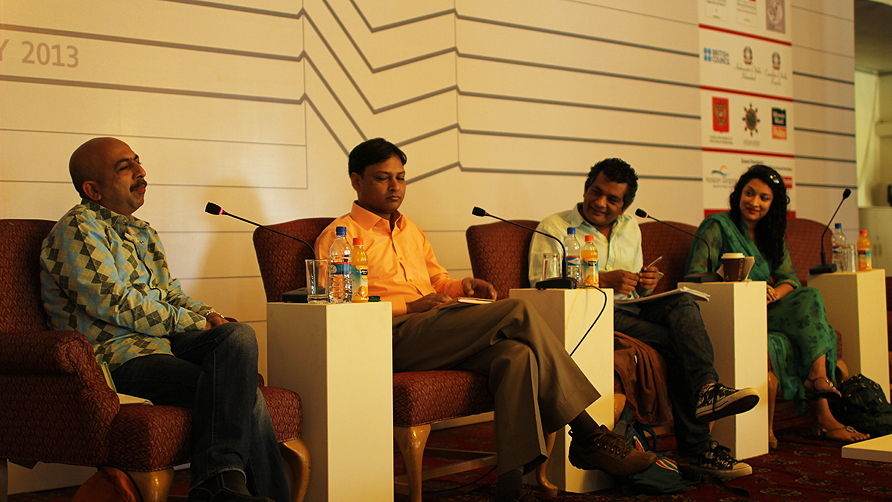
You are a GUI agent. You are given a task and a screenshot of the screen. Output one action in this format:
    pyautogui.click(x=<x>, y=<y>)
    Task: Click on the 1 poster
    The image size is (892, 502).
    Given the screenshot: What is the action you would take?
    pyautogui.click(x=779, y=116)